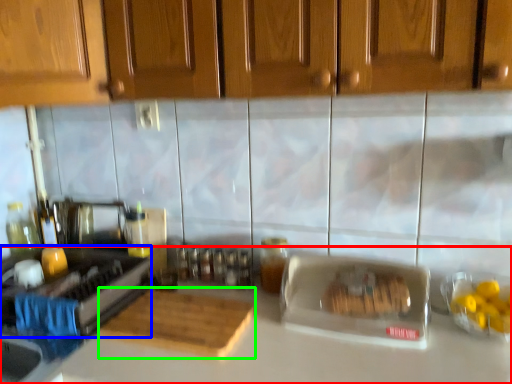
Question: Estimate the real-world distances between objects in this image. Which object is farther from countertop (highlighted by a red box), appliance (highlighted by a blue box) or cutting board (highlighted by a green box)?

Choices:
 (A) appliance
 (B) cutting board

Answer: (A)